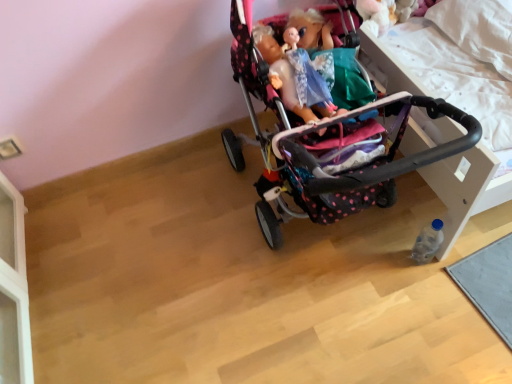
The height and width of the screenshot is (384, 512). I want to click on free spot below polka dot fabric stroller at center (from a real-world perspective), so click(328, 244).